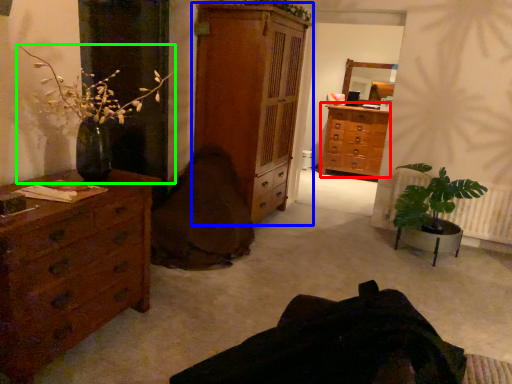
Question: Based on their relative distances, which object is nearer to chest of drawers (highlighted by a red box)? Choose from chest of drawers (highlighted by a blue box) and houseplant (highlighted by a green box).

Choices:
 (A) chest of drawers
 (B) houseplant

Answer: (A)